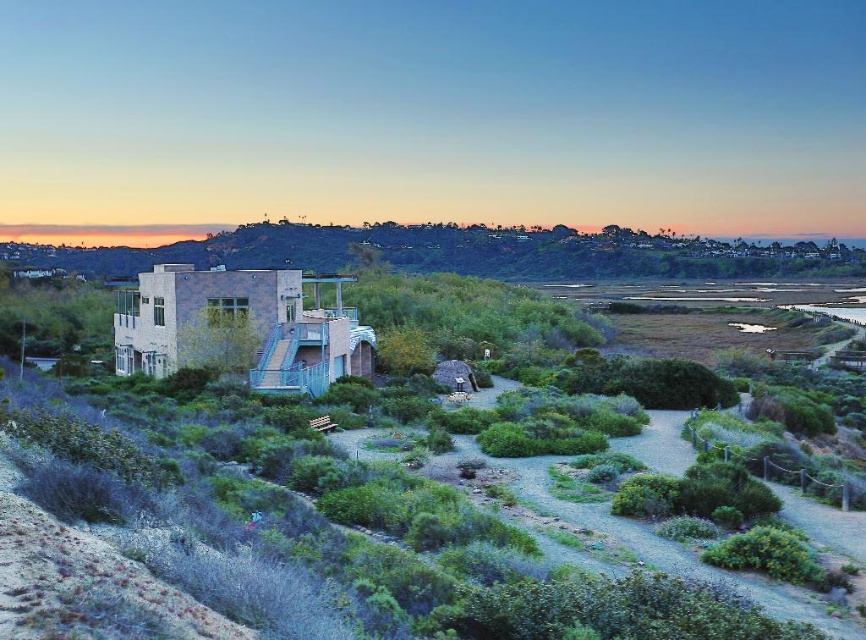
Question: Does green leafy shrubs at center appear under green grassy hillside at center?

Choices:
 (A) no
 (B) yes

Answer: (B)

Question: Does green leafy shrubs at center have a greater width compared to green grassy hillside at center?

Choices:
 (A) yes
 (B) no

Answer: (B)

Question: Does green leafy shrubs at center appear under green grassy hillside at center?

Choices:
 (A) no
 (B) yes

Answer: (B)

Question: Which object appears farthest from the camera in this image?

Choices:
 (A) green leafy shrubs at center
 (B) green grassy hillside at center

Answer: (B)

Question: Which point is farther from the camera taking this photo?

Choices:
 (A) (779, 250)
 (B) (183, 384)

Answer: (A)